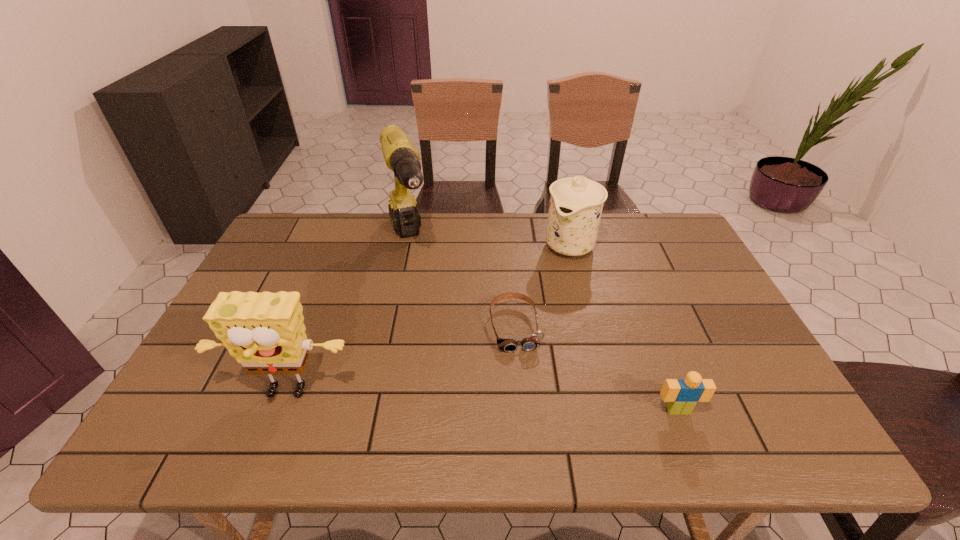
Identify the location of vacant spot on the desktop that is between the sponge and the Lego and is positioned on the front-facing side of the goggles. click(532, 404).

Locate an element on the screen. Image resolution: width=960 pixels, height=540 pixels. free space on the desktop that is between the sponge and the second shortest object and is positioned on the spout of the chinaware is located at coordinates (450, 401).

The width and height of the screenshot is (960, 540). I want to click on vacant spot on the desktop that is between the sponge and the Lego and is positioned on the handle side of the drill, so click(x=469, y=401).